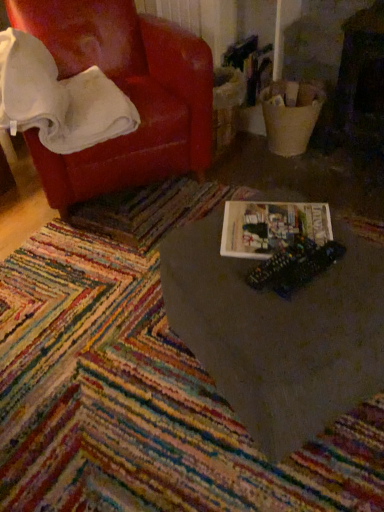
Question: From a real-world perspective, is metallic plastic toy at center physically located above or below hardcover book at center?

Choices:
 (A) below
 (B) above

Answer: (B)

Question: Looking at their shapes, would you say metallic plastic toy at center is wider or thinner than hardcover book at center?

Choices:
 (A) wide
 (B) thin

Answer: (A)

Question: Estimate the real-world distances between objects in this image. Which object is farther from the multicolored woven mat at center?

Choices:
 (A) white glossy book at center
 (B) white soft blanket at upper left
 (C) hardcover book at center
 (D) metallic plastic toy at center
 (E) leather-like red armchair at upper left

Answer: (E)

Question: Considering the real-world distances, which object is closest to the hardcover book at center?

Choices:
 (A) white soft blanket at upper left
 (B) metallic plastic toy at center
 (C) multicolored woven mat at center
 (D) white glossy book at center
 (E) leather-like red armchair at upper left

Answer: (B)